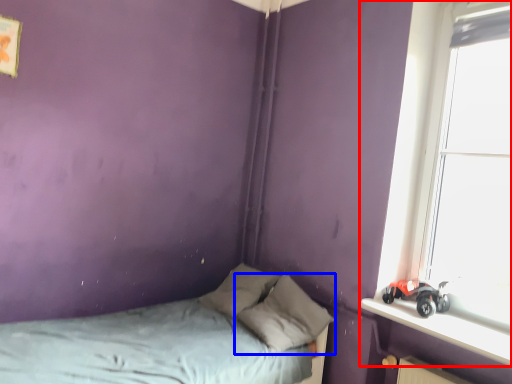
Question: Among these objects, which one is farthest to the camera, window (highlighted by a red box) or pillow (highlighted by a blue box)?

Choices:
 (A) window
 (B) pillow

Answer: (B)